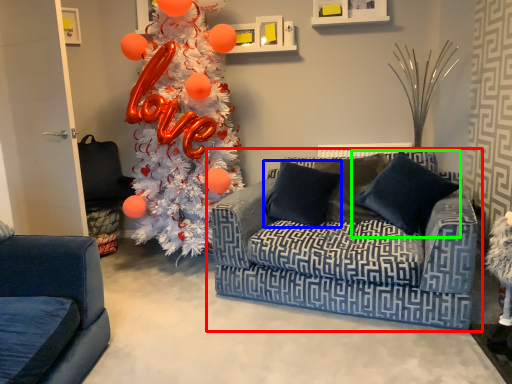
Question: Which is nearer to the studio couch (highlighted by a red box)? pillow (highlighted by a blue box) or pillow (highlighted by a green box).

Choices:
 (A) pillow
 (B) pillow

Answer: (A)